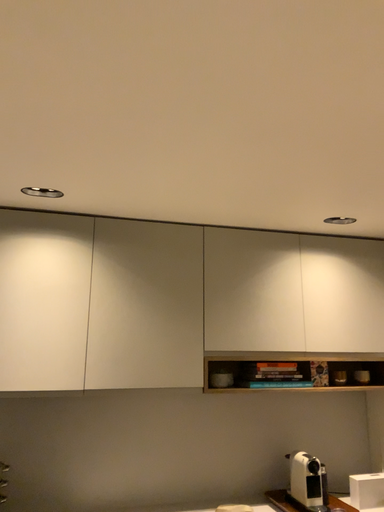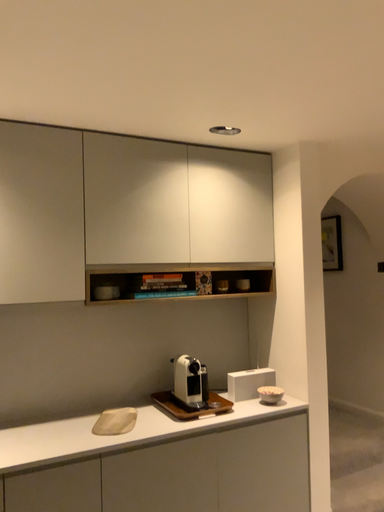
Question: Which way did the camera rotate in the video?

Choices:
 (A) rotated upward
 (B) rotated downward

Answer: (B)